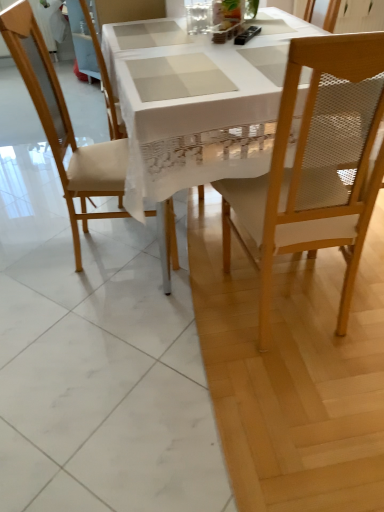
Find the location of a particular element. vacant area that lies between light wood mesh chair at right, which is the first chair in right-to-left order, and white lace tablecloth at center is located at coordinates (x=233, y=322).